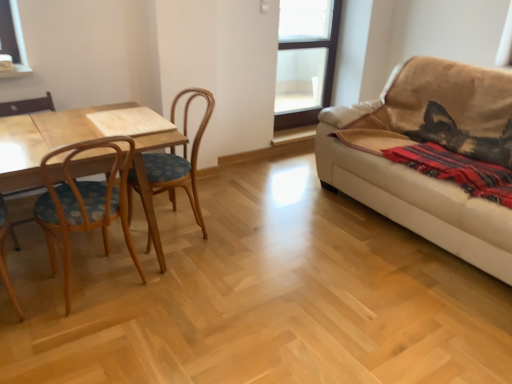
The width and height of the screenshot is (512, 384). In order to click on vacant area to the left of beige fabric couch at right in this screenshot , I will do `click(278, 238)`.